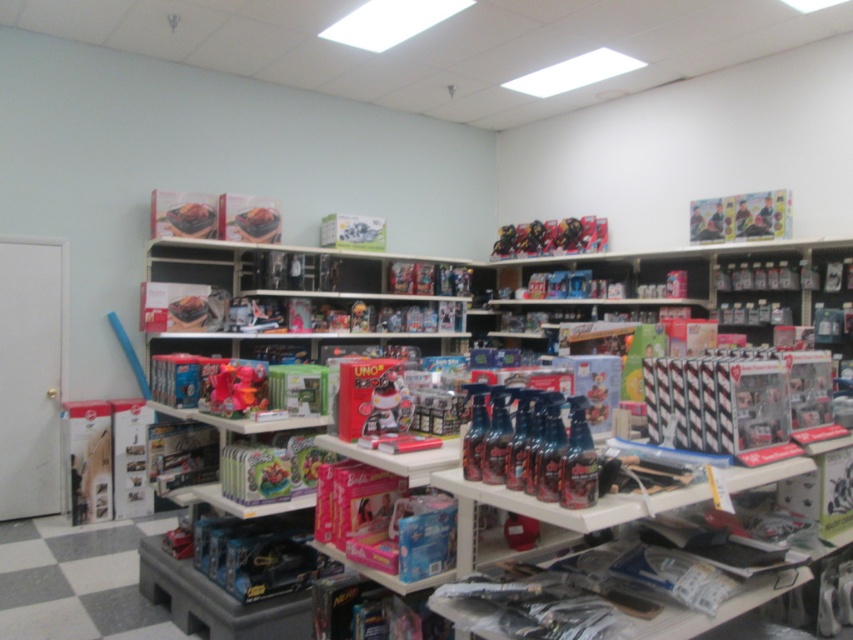
Question: Does mattel action figures at upper center have a smaller size compared to matte pink plush at center?

Choices:
 (A) yes
 (B) no

Answer: (B)

Question: Based on their relative distances, which object is nearer to the mattel action figures at upper center?

Choices:
 (A) matte pink plush at center
 (B) matte plastic robot at center

Answer: (A)

Question: Is mattel action figures at upper center smaller than matte plastic robot at center?

Choices:
 (A) yes
 (B) no

Answer: (B)

Question: Among these objects, which one is farthest from the camera?

Choices:
 (A) matte pink plush at center
 (B) mattel action figures at upper center

Answer: (B)

Question: Does mattel action figures at upper center appear over matte plastic robot at center?

Choices:
 (A) no
 (B) yes

Answer: (B)

Question: Estimate the real-world distances between objects in this image. Which object is closer to the matte plastic robot at center?

Choices:
 (A) glossy plastic spray bottles at center
 (B) mattel action figures at upper center

Answer: (A)